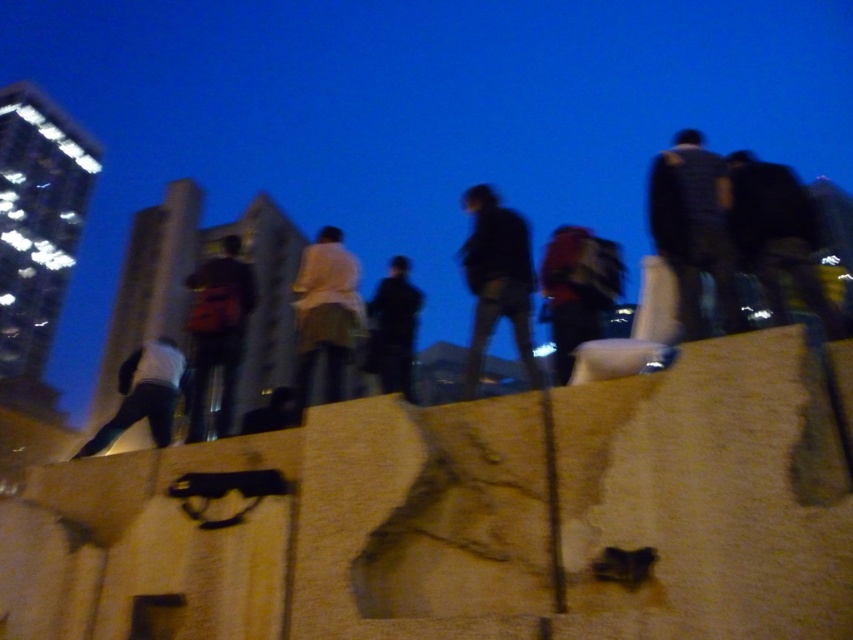
Question: Which of the following is the closest to the observer?

Choices:
 (A) dark gray backpack at upper right
 (B) red backpack at center

Answer: (A)

Question: Which point appears closest to the camera in this image?

Choices:
 (A) (338, 364)
 (B) (676, 138)
 (C) (582, 300)

Answer: (C)

Question: Is matte black backpack at center positioned at the back of dark gray pants at left?

Choices:
 (A) yes
 (B) no

Answer: (A)

Question: Where is matte black backpack at center located in relation to red backpack at center in the image?

Choices:
 (A) above
 (B) below

Answer: (A)

Question: Does dark blue textured jacket at upper right appear under dark gray backpack at upper right?

Choices:
 (A) no
 (B) yes

Answer: (A)

Question: Which object is closer to the camera taking this photo?

Choices:
 (A) dark blue textured jacket at upper right
 (B) dark gray pants at left
 (C) dark blue jeans at center
 (D) dark blue fabric jacket at center

Answer: (D)